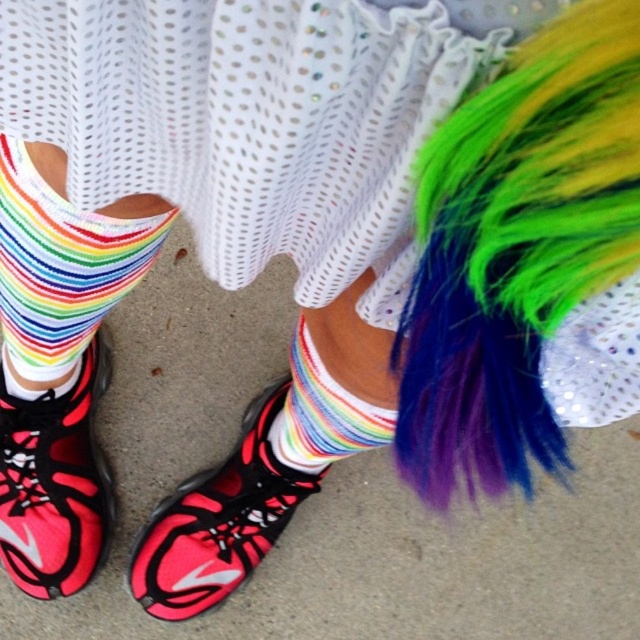
What do you see at coordinates (218, 520) in the screenshot?
I see `neon pink synthetic sneaker at lower left` at bounding box center [218, 520].

Is neon pink synthetic sneaker at lower left taller than rainbow striped sock at center?

Indeed, neon pink synthetic sneaker at lower left has a greater height compared to rainbow striped sock at center.

This screenshot has height=640, width=640. Describe the element at coordinates (218, 520) in the screenshot. I see `neon pink synthetic sneaker at lower left` at that location.

Locate an element on the screen. This screenshot has height=640, width=640. neon pink synthetic sneaker at lower left is located at coordinates (218, 520).

This screenshot has width=640, height=640. Describe the element at coordinates (60, 268) in the screenshot. I see `rainbow striped socks at lower left` at that location.

Between rainbow striped socks at lower left and rainbow striped sock at center, which one appears on the left side from the viewer's perspective?

rainbow striped socks at lower left

I want to click on rainbow striped socks at lower left, so click(x=60, y=268).

Is shiny pink and black sneaker at lower left thinner than neon pink synthetic sneaker at lower left?

Yes.

Does shiny pink and black sneaker at lower left appear over neon pink synthetic sneaker at lower left?

Correct, shiny pink and black sneaker at lower left is located above neon pink synthetic sneaker at lower left.

Does point (108, 368) lie behind point (250, 518)?

Yes, it is.

Locate an element on the screen. shiny pink and black sneaker at lower left is located at coordinates (54, 483).